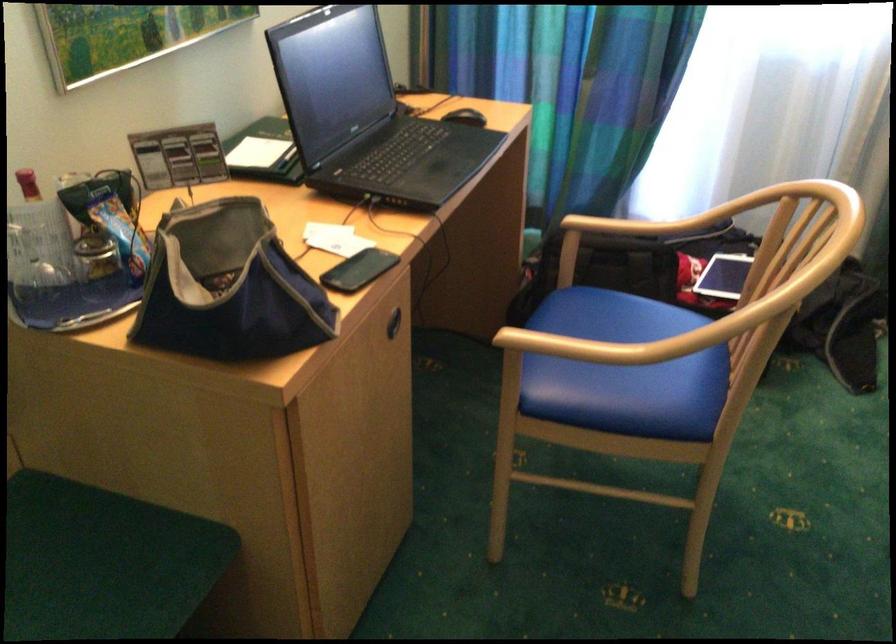
Find the location of a particular element. The height and width of the screenshot is (644, 896). blue chair sitting surface is located at coordinates (624, 370).